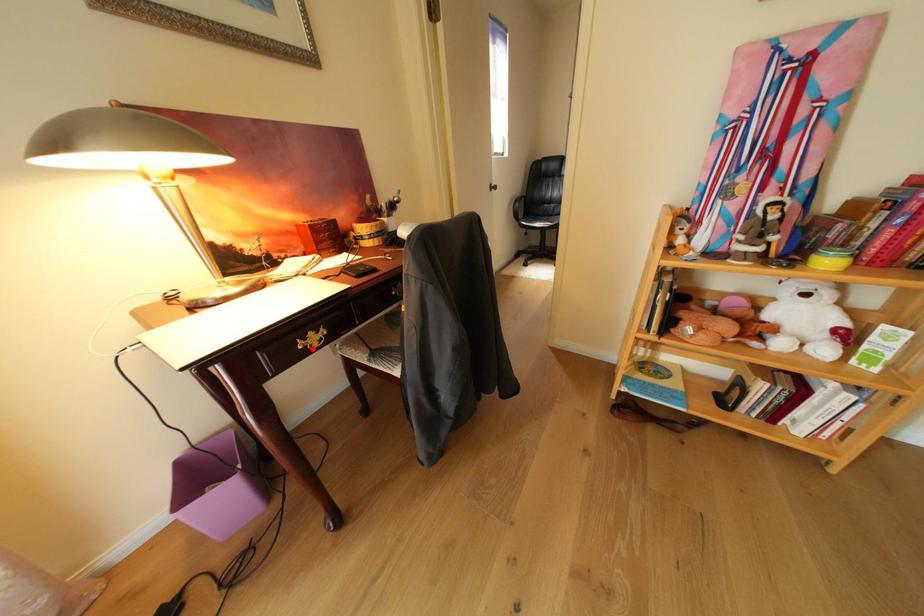
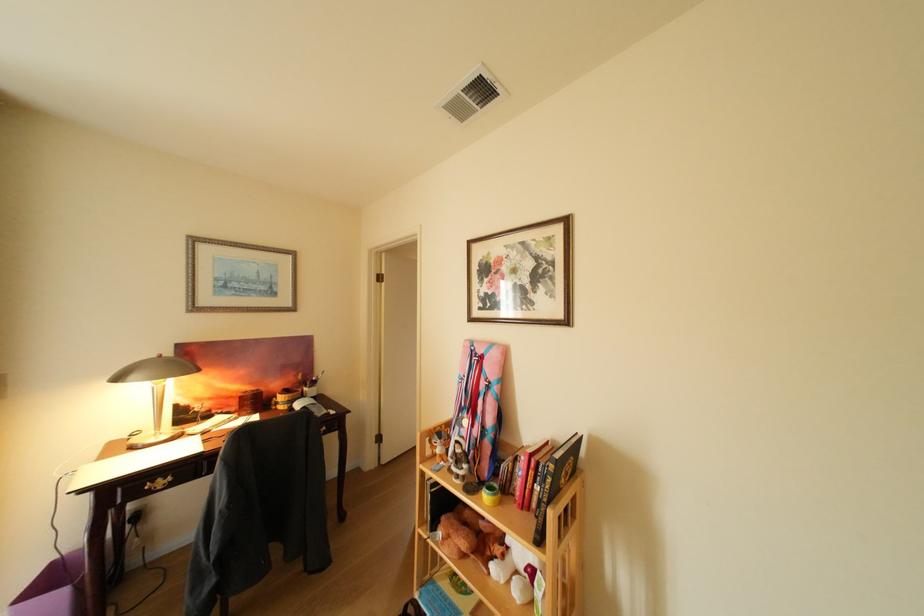
The point at the highlighted location is marked in the first image. Where is the corresponding point in the second image?

(160, 490)